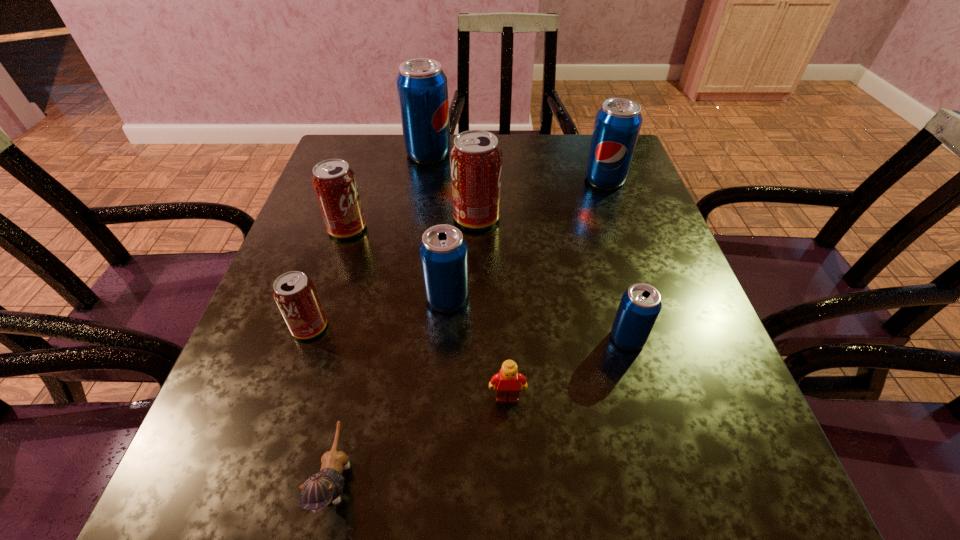
Where is `Lego`? The height and width of the screenshot is (540, 960). Lego is located at coordinates (506, 382).

Locate an element on the screen. The image size is (960, 540). kitten is located at coordinates (320, 489).

The height and width of the screenshot is (540, 960). I want to click on vacant point located 0.060m on the front of the biggest blue pop soda, so click(424, 178).

Find the location of a particular element. vacant space located on the back of the second farthest object is located at coordinates (595, 152).

Where is `free space located on the front of the rightmost red soda can`? The height and width of the screenshot is (540, 960). free space located on the front of the rightmost red soda can is located at coordinates (475, 363).

You are a GUI agent. You are given a task and a screenshot of the screen. Output one action in this format:
    pyautogui.click(x=<x>, y=<y>)
    Task: Click on the vacant area situated 0.360m on the right of the third farthest blue pop soda
    The height and width of the screenshot is (540, 960).
    Given the screenshot: What is the action you would take?
    pyautogui.click(x=658, y=299)

This screenshot has width=960, height=540. In order to click on free space located on the front of the second smallest red soda can in this screenshot , I will do `click(308, 348)`.

Where is `free spot located 0.200m on the left of the nearest blue pop soda`? Image resolution: width=960 pixels, height=540 pixels. free spot located 0.200m on the left of the nearest blue pop soda is located at coordinates (496, 339).

Find the location of a particular element. The height and width of the screenshot is (540, 960). vacant region located 0.200m on the front of the smallest red soda can is located at coordinates (267, 456).

Where is `vacant space situated on the face of the brown Lego`? vacant space situated on the face of the brown Lego is located at coordinates (509, 435).